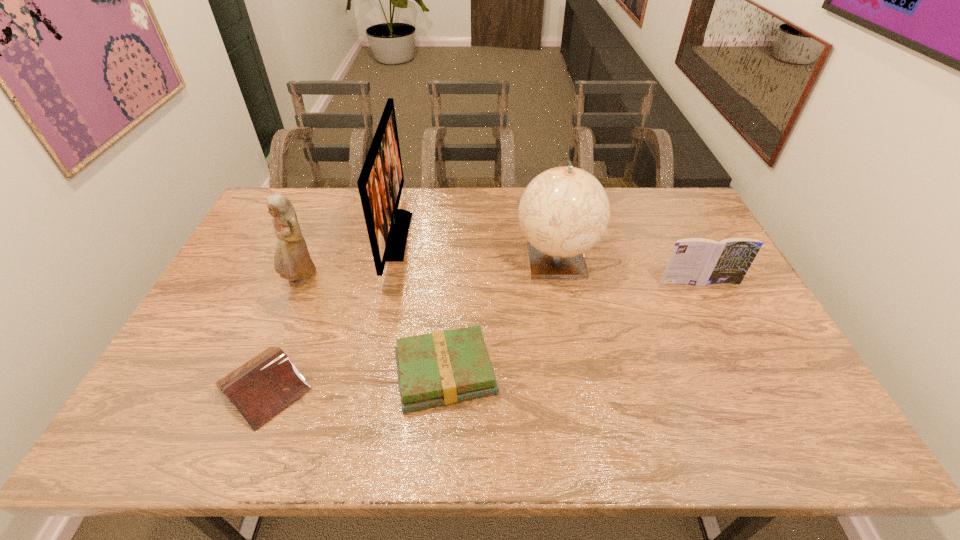
This screenshot has width=960, height=540. In the image, there is a desktop. Find the location of `vacant area at the right edge`. vacant area at the right edge is located at coordinates (716, 291).

In the image, there is a desktop. Find the location of `free region at the far right corner`. free region at the far right corner is located at coordinates (696, 218).

The image size is (960, 540). Find the location of `free spot between the figurine and the leftmost book`. free spot between the figurine and the leftmost book is located at coordinates (282, 333).

The width and height of the screenshot is (960, 540). Identify the location of free area in between the second object from right to left and the figurine. (428, 269).

Identify the location of free spot between the fourth object from left to right and the fourth object from right to left. The width and height of the screenshot is (960, 540). (420, 305).

This screenshot has height=540, width=960. In order to click on vacant region between the monitor and the globe in this screenshot , I will do `click(475, 247)`.

Locate an element on the screen. Image resolution: width=960 pixels, height=540 pixels. free space between the monitor and the globe is located at coordinates (475, 247).

In order to click on free space between the second book from right to left and the globe in this screenshot , I will do `click(500, 316)`.

At what (x,y) coordinates should I click in order to perform the action: click on free space between the monitor and the leftmost book. Please return your answer as a coordinate pair (x, y). This screenshot has height=540, width=960. Looking at the image, I should click on (329, 311).

At what (x,y) coordinates should I click in order to perform the action: click on vacant space that is in between the third shortest object and the second object from right to left. Please return your answer as a coordinate pair (x, y). Looking at the image, I should click on (627, 271).